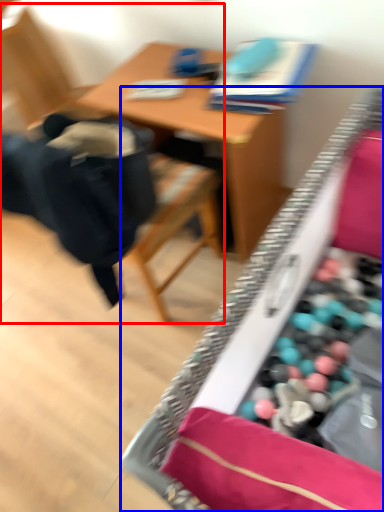
Question: Which point is further to the camera, chair (highlighted by a red box) or desk (highlighted by a blue box)?

Choices:
 (A) chair
 (B) desk

Answer: (A)